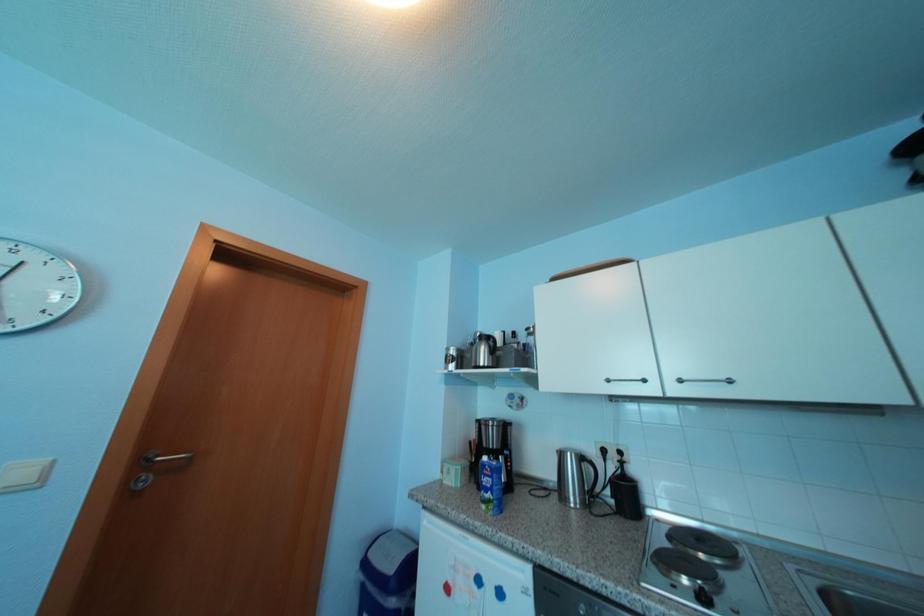
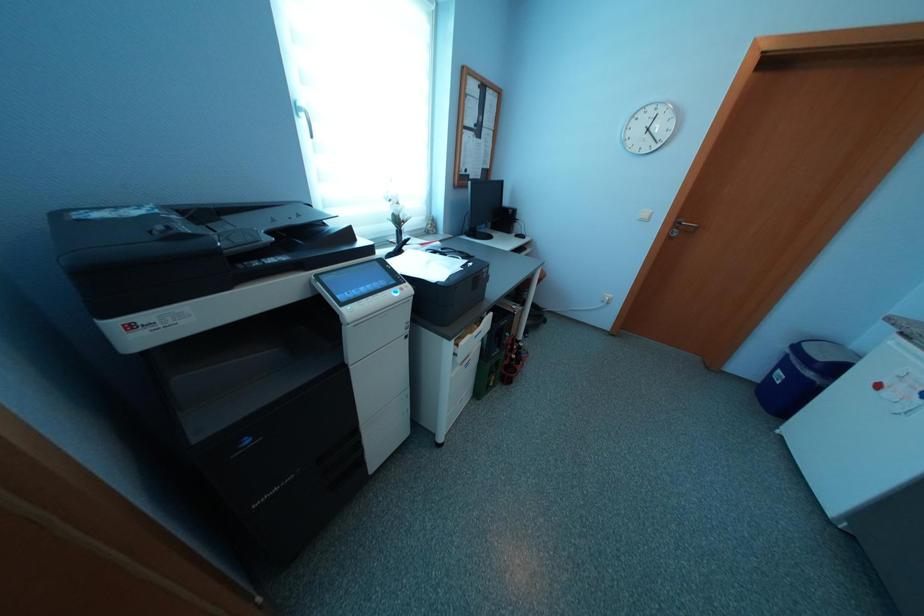
Consider the image. The images are taken continuously from a first-person perspective. In which direction is your viewpoint rotating?

The camera rotated toward left-down.